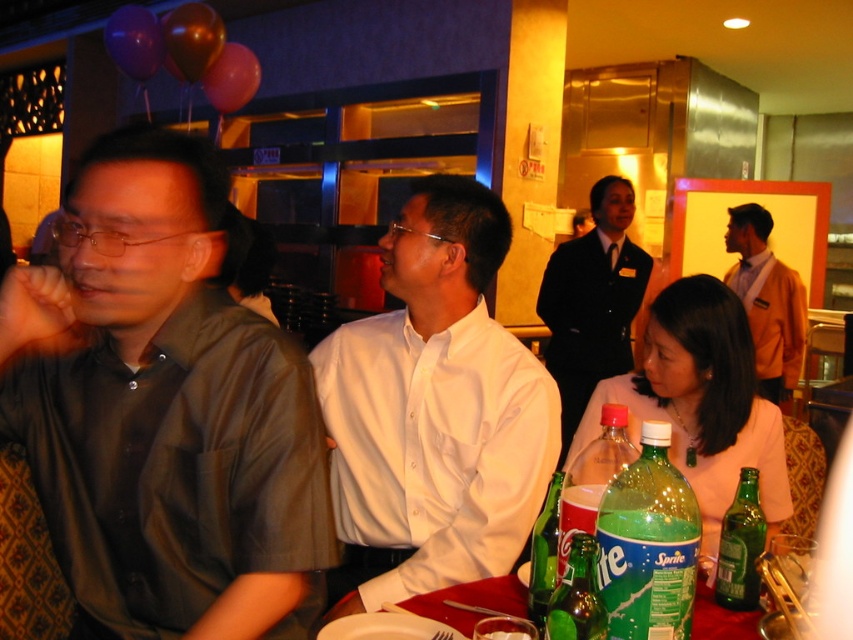
Who is positioned more to the left, green plastic bottle at lower right or orange fabric shirt at right?

green plastic bottle at lower right is more to the left.

Can you confirm if green plastic bottle at lower right is bigger than orange fabric shirt at right?

No.

You are a GUI agent. You are given a task and a screenshot of the screen. Output one action in this format:
    pyautogui.click(x=<x>, y=<y>)
    Task: Click on the green plastic bottle at lower right
    This screenshot has height=640, width=853.
    Given the screenshot: What is the action you would take?
    pyautogui.click(x=648, y=545)

Between green matte bottle at lower center and green glass bottle at lower center, which one appears on the right side from the viewer's perspective?

From the viewer's perspective, green matte bottle at lower center appears more on the right side.

Can you confirm if green matte bottle at lower center is shorter than green glass bottle at lower center?

Yes.

The image size is (853, 640). Identify the location of green matte bottle at lower center. (577, 595).

Can you confirm if white shirt at center is positioned to the left of green matte bottle at lower center?

Incorrect, white shirt at center is not on the left side of green matte bottle at lower center.

This screenshot has height=640, width=853. Describe the element at coordinates (592, 301) in the screenshot. I see `white shirt at center` at that location.

Where is `white shirt at center`? This screenshot has width=853, height=640. white shirt at center is located at coordinates (592, 301).